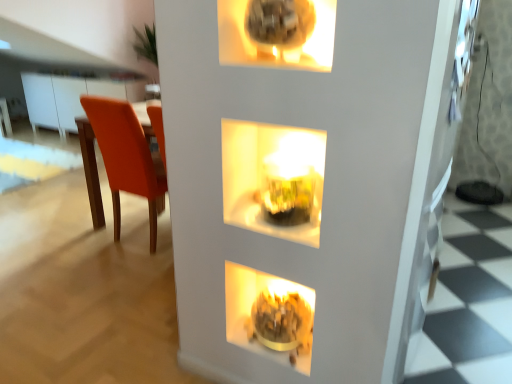
Image resolution: width=512 pixels, height=384 pixels. What do you see at coordinates (269, 315) in the screenshot? I see `matte gold bowl at lower center` at bounding box center [269, 315].

Identify the location of matte gold bowl at lower center. (269, 315).

What is the approximate width of orange matte chair at left?

It is 24.19 inches.

What do you see at coordinates (126, 158) in the screenshot? I see `orange matte chair at left` at bounding box center [126, 158].

Image resolution: width=512 pixels, height=384 pixels. What are the coordinates of `translucent glass vase at center` in the screenshot? It's located at (274, 179).

Does point (304, 346) come behind point (324, 137)?

Yes, point (304, 346) is farther from viewer.

You are a GUI agent. You are given a task and a screenshot of the screen. Output one action in this format:
    pyautogui.click(x=<x>, y=<y>)
    Task: Click on the shelf above the matte gold bowl at lower center (from the image's perspective)
    This screenshot has width=512, height=384.
    Given the screenshot: What is the action you would take?
    pyautogui.click(x=274, y=179)

How different are the orientations of matte gold bowl at lower center and translucent glass vase at center in degrees?

0.00136 degrees.

In the scene shown: Based on their positions, is matte gold bowl at lower center located to the left or right of orange matte chair at left?

matte gold bowl at lower center is to the right of orange matte chair at left.

Which is behind, point (255, 302) or point (83, 157)?

The point (83, 157) is farther.

Is matte gold bowl at lower center closer to camera compared to orange matte chair at left?

Yes.

From a real-world perspective, is matte gold bowl at lower center positioned above or below orange matte chair at left?

In terms of real-world spatial position, matte gold bowl at lower center is below orange matte chair at left.

Does translucent glass vase at center lie behind matte gold bowl at lower center?

No, translucent glass vase at center is in front of matte gold bowl at lower center.

Find the location of a particular element. fireplace below the translucent glass vase at center (from the image's perspective) is located at coordinates (269, 315).

Considering the points (273, 232) and (294, 354), which point is in front, point (273, 232) or point (294, 354)?

The point (273, 232) is closer to the camera.

What's the angular difference between orange matte chair at left and matte gold bowl at lower center's facing directions?

orange matte chair at left and matte gold bowl at lower center are facing 179 degrees away from each other.

In the scene shown: From the image's perspective, relative to matte gold bowl at lower center, is orange matte chair at left above or below?

Based on their image positions, orange matte chair at left is located above matte gold bowl at lower center.

Does orange matte chair at left turn towards matte gold bowl at lower center?

No, orange matte chair at left is not facing towards matte gold bowl at lower center.

Is orange matte chair at left wider than matte gold bowl at lower center?

Indeed, orange matte chair at left has a greater width compared to matte gold bowl at lower center.

The height and width of the screenshot is (384, 512). In order to click on shelf above the orange matte chair at left (from a real-world perspective) in this screenshot , I will do `click(274, 179)`.

From a real-world perspective, is orange matte chair at left over translucent glass vase at center?

No, from a real-world perspective, orange matte chair at left is not over translucent glass vase at center

Is orange matte chair at left looking in the opposite direction of translucent glass vase at center?

That's not correct — orange matte chair at left is not looking away from translucent glass vase at center.

In terms of width, does orange matte chair at left look wider or thinner when compared to translucent glass vase at center?

Clearly, orange matte chair at left has more width compared to translucent glass vase at center.

Considering the sizes of objects translucent glass vase at center and orange matte chair at left in the image provided, who is bigger, translucent glass vase at center or orange matte chair at left?

Bigger between the two is orange matte chair at left.

Is translucent glass vase at center taller or shorter than orange matte chair at left?

In the image, translucent glass vase at center appears to be shorter than orange matte chair at left.

Is point (281, 145) more distant than point (92, 214)?

No, it is not.

In the scene shown: Is orange matte chair at left inside translucent glass vase at center?

Definitely not — orange matte chair at left is not inside translucent glass vase at center.

Where is `shelf on the right of matte gold bowl at lower center`? The image size is (512, 384). shelf on the right of matte gold bowl at lower center is located at coordinates (274, 179).

In the image, there is a matte gold bowl at lower center. Identify the location of chair above it (from the image's perspective). (126, 158).

Estimate the real-world distances between objects in this image. Which object is closer to orange matte chair at left, translucent glass vase at center or matte gold bowl at lower center?

Based on the image, translucent glass vase at center appears to be nearer to orange matte chair at left.

From the image, which object appears to be farther from translucent glass vase at center, matte gold bowl at lower center or orange matte chair at left?

Among the two, orange matte chair at left is located further to translucent glass vase at center.

Which object lies further to the anchor point orange matte chair at left, matte gold bowl at lower center or translucent glass vase at center?

Among the two, matte gold bowl at lower center is located further to orange matte chair at left.

Which object lies further to the anchor point translucent glass vase at center, orange matte chair at left or matte gold bowl at lower center?

The object further to translucent glass vase at center is orange matte chair at left.

Based on their spatial positions, is translucent glass vase at center or orange matte chair at left further from matte gold bowl at lower center?

Among the two, orange matte chair at left is located further to matte gold bowl at lower center.

From the image, which object appears to be nearer to matte gold bowl at lower center, orange matte chair at left or translucent glass vase at center?

Based on the image, translucent glass vase at center appears to be nearer to matte gold bowl at lower center.

Identify the location of fireplace positioned between translucent glass vase at center and orange matte chair at left from near to far. (269, 315).